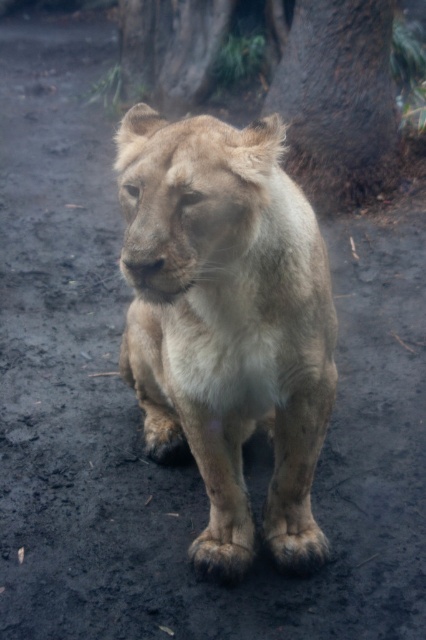
You are a zookeeper who needs to feed the fuzzy beige lion at center. The food is placed near the brown rough bark at upper center. Can the lion reach the food without moving closer?

The distance between the fuzzy beige lion at center and the brown rough bark at upper center is 2.60 meters. Since lions typically cannot reach food that far away with their mouths, the lion cannot reach the food without moving closer.

You are a zookeeper planning to place a new feeding station in the enclosure. The feeding station requires a space larger than the brown rough bark at upper center. Can the fuzzy beige lion at center be used to determine if the space is sufficient?

The fuzzy beige lion at center has a larger size compared to brown rough bark at upper center, so the space where the fuzzy beige lion at center is located should be sufficient for the feeding station since it can accommodate an object larger than the brown rough bark at upper center.